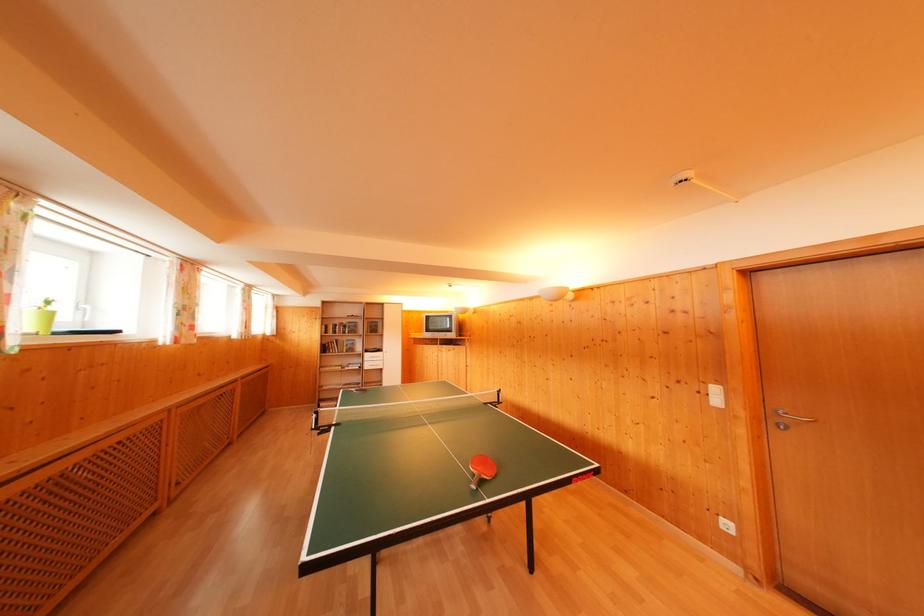
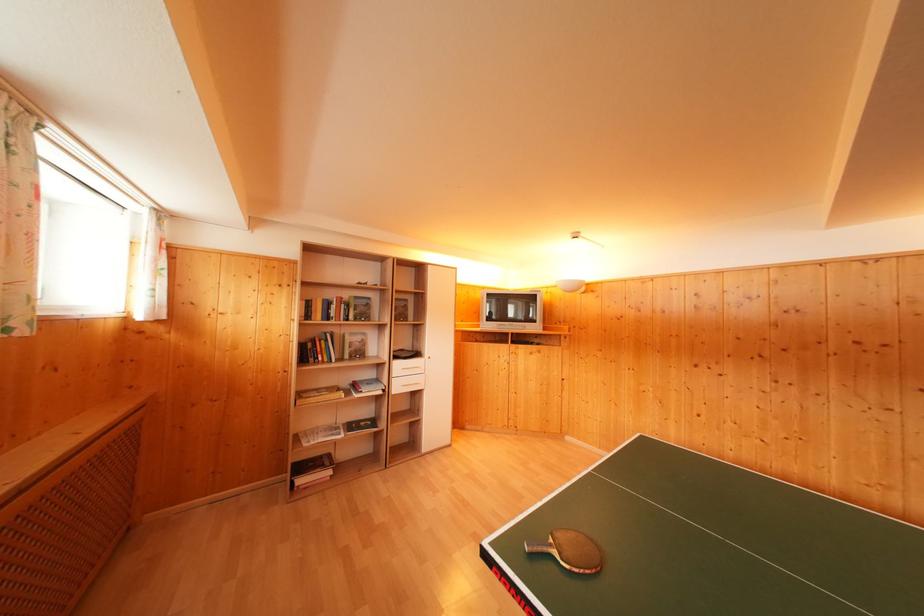
The point at [371,363] is marked in the first image. Where is the corresponding point in the second image?

(398, 379)